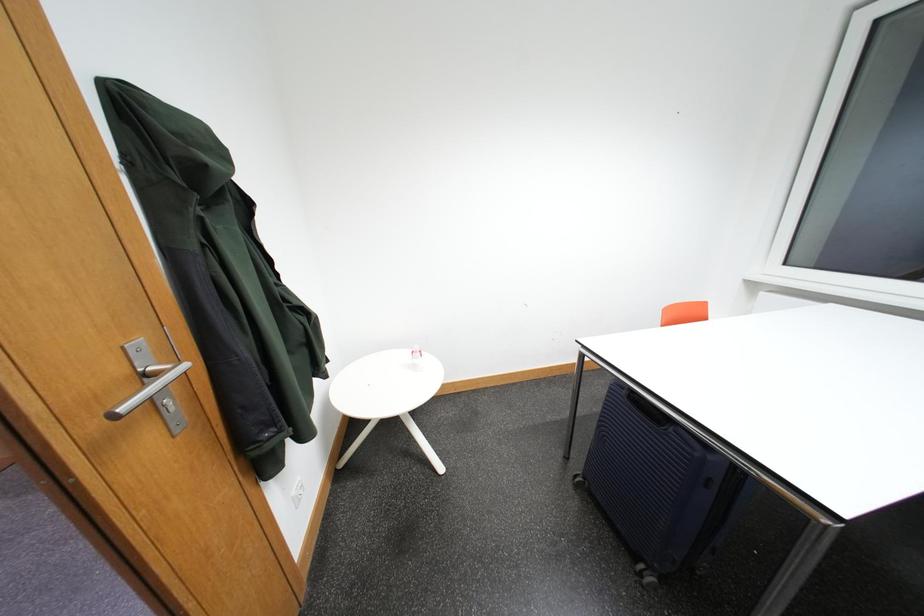
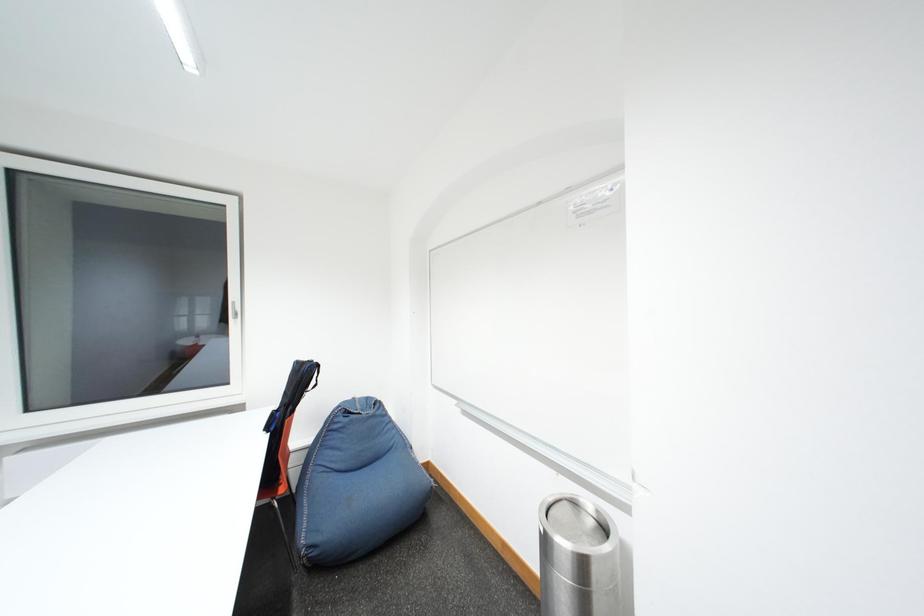
Question: The camera is either moving clockwise (left) or counter-clockwise (right) around the object. The first image is from the beginning of the video and the second image is from the end. Is the camera moving left or right when shooting the video?

Choices:
 (A) Left
 (B) Right

Answer: (A)